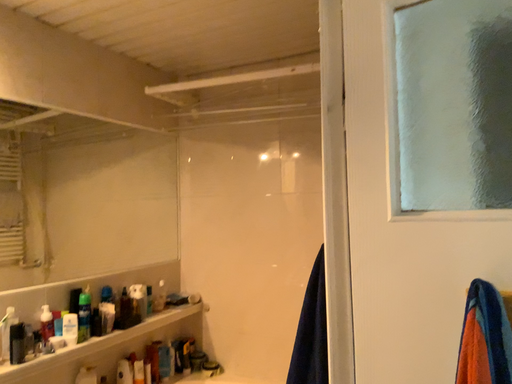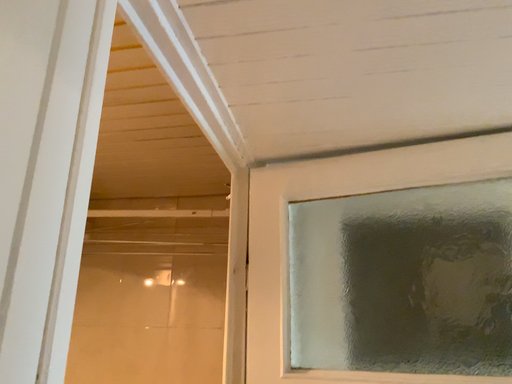
Question: How did the camera likely rotate when shooting the video?

Choices:
 (A) rotated upward
 (B) rotated downward

Answer: (A)